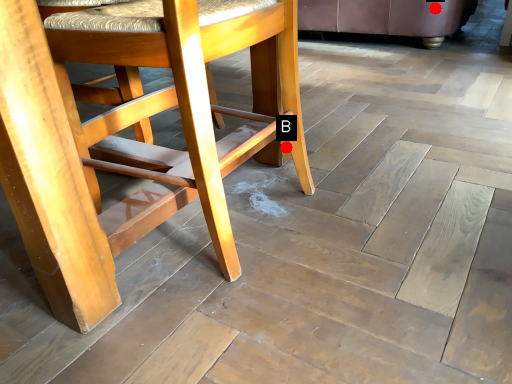
Question: Two points are circled on the image, labeled by A and B beside each circle. Among these points, which one is farthest from the camera?

Choices:
 (A) A is further
 (B) B is further

Answer: (A)